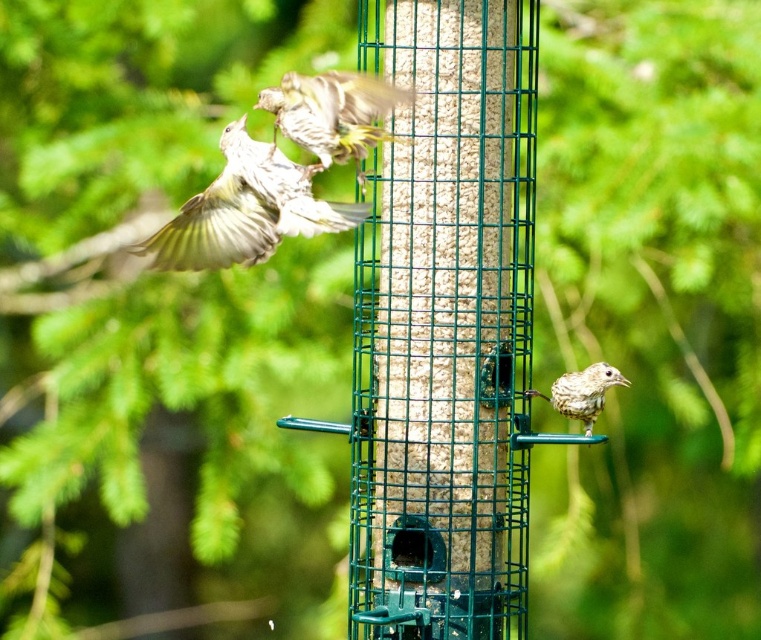
Question: Can you confirm if brown speckled feathers at upper center is smaller than brown speckled bird at lower right?

Choices:
 (A) no
 (B) yes

Answer: (A)

Question: Considering the real-world distances, which object is closest to the brown speckled bird at lower right?

Choices:
 (A) brown speckled feathers at upper center
 (B) brown speckled feathers at upper left

Answer: (A)

Question: Which point is farther from the camera taking this photo?

Choices:
 (A) (586, 376)
 (B) (161, 234)
 (C) (325, 92)

Answer: (A)

Question: Can you confirm if brown speckled feathers at upper center is smaller than brown speckled bird at lower right?

Choices:
 (A) no
 (B) yes

Answer: (A)

Question: Does brown speckled feathers at upper center lie behind brown speckled bird at lower right?

Choices:
 (A) no
 (B) yes

Answer: (A)

Question: Which point is farther to the camera?

Choices:
 (A) (580, 390)
 (B) (307, 150)
 (C) (180, 228)

Answer: (A)